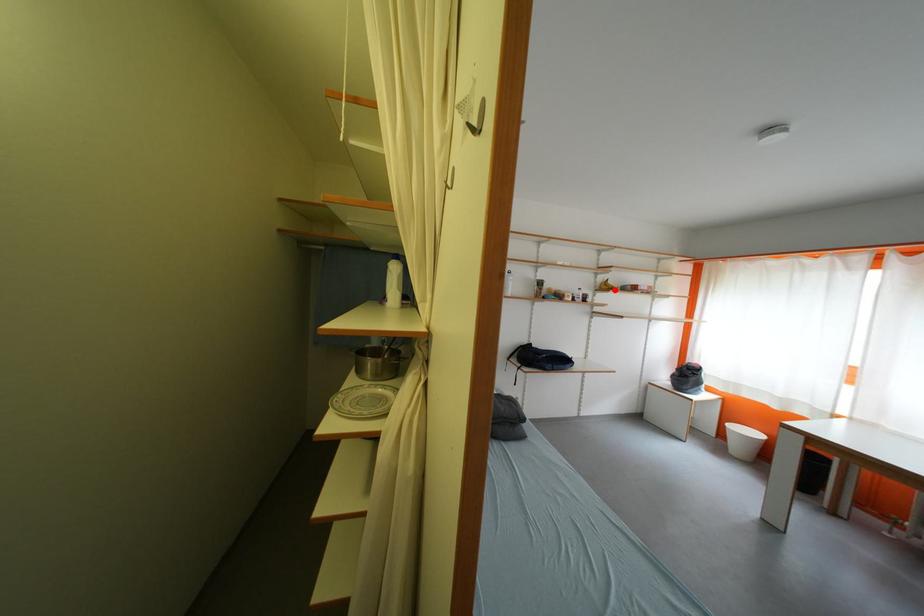
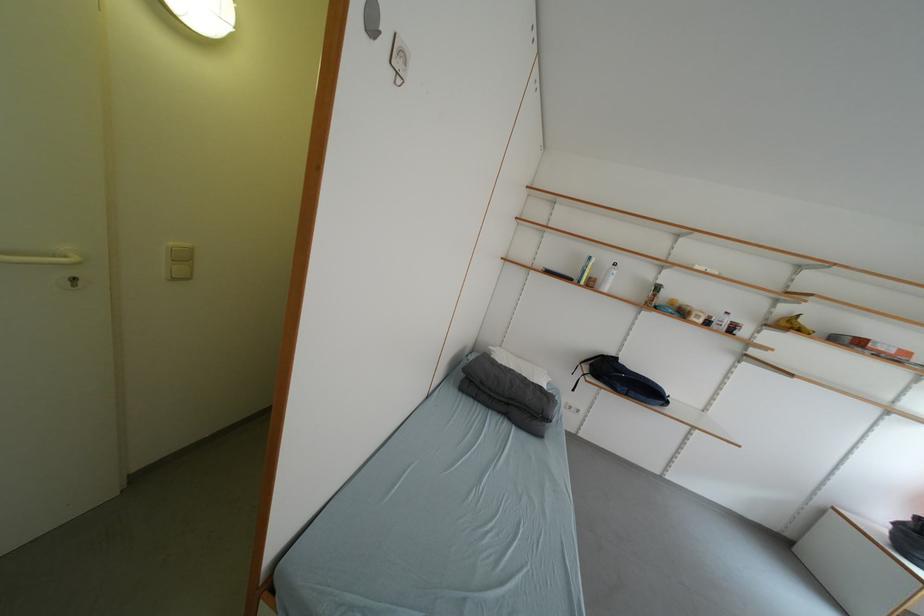
Question: I am providing you with two images of the same scene from different viewpoints. A red point is marked on the first image. Is the red point's position out of view in image 2?

Choices:
 (A) Yes
 (B) No

Answer: (B)